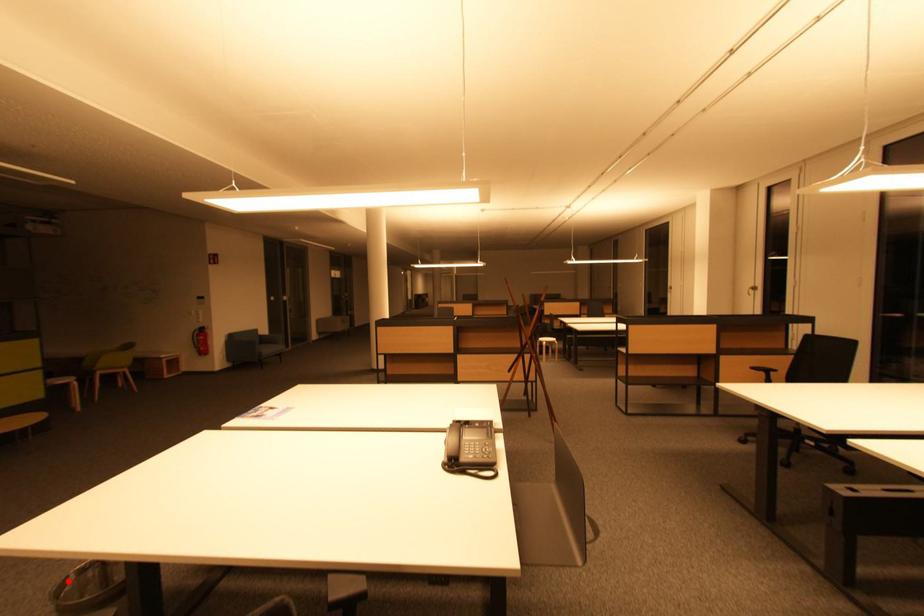
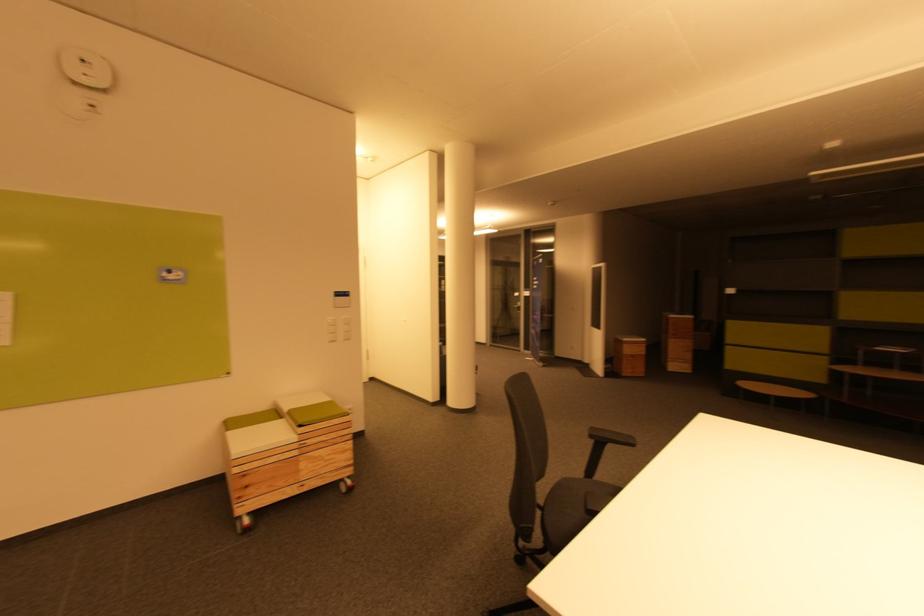
Question: I am providing you with two images of the same scene from different viewpoints. A red point is marked on the first image. At the location where the point appears in image 1, is it still visible in image 2?

Choices:
 (A) Yes
 (B) No

Answer: (B)